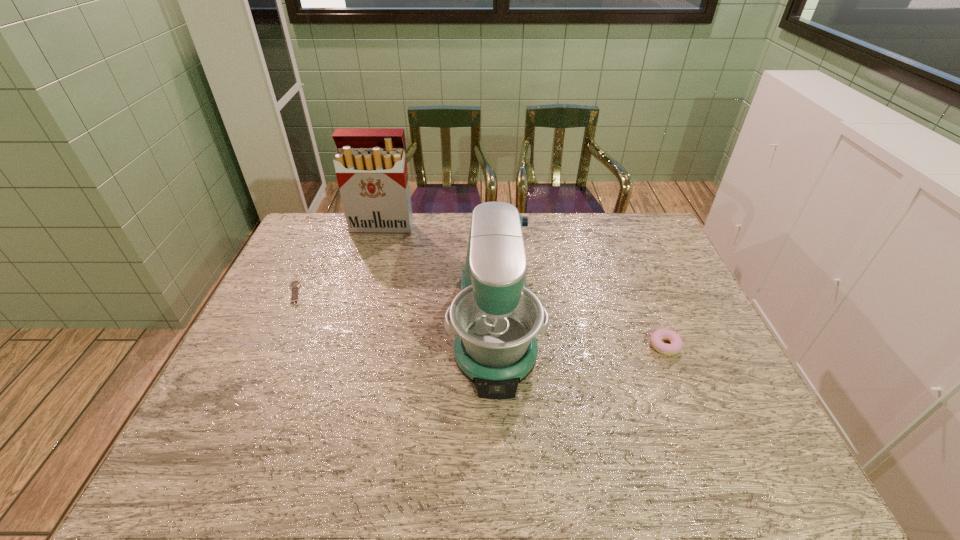
Find the location of `free space that satisfies the following two spatial constraints: 1. with the lid open on the second object from left to right; 2. on the right side of the doughnut`. free space that satisfies the following two spatial constraints: 1. with the lid open on the second object from left to right; 2. on the right side of the doughnut is located at coordinates (348, 346).

Find the location of a particular element. The width and height of the screenshot is (960, 540). blank space that satisfies the following two spatial constraints: 1. on the front-facing side of the rightmost object; 2. on the left side of the third object from left to right is located at coordinates (495, 346).

Find the location of a particular element. This screenshot has height=540, width=960. free point that satisfies the following two spatial constraints: 1. on the front-facing side of the third tallest object; 2. on the left side of the mixer is located at coordinates (495, 346).